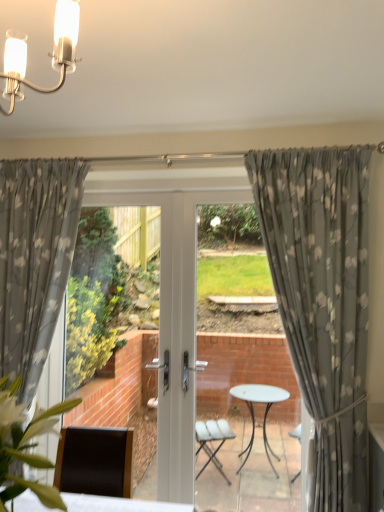
This screenshot has width=384, height=512. In order to click on white glossy light fixture at upper left in this screenshot , I will do `click(48, 54)`.

How much space does gray floral fabric curtain at center, which is counted as the 2th curtain, starting from the left, occupy vertically?

The height of gray floral fabric curtain at center, which is counted as the 2th curtain, starting from the left, is 6.14 feet.

The width and height of the screenshot is (384, 512). Describe the element at coordinates (35, 259) in the screenshot. I see `gray floral curtain at left, which is the first curtain in left-to-right order` at that location.

Locate an element on the screen. The width and height of the screenshot is (384, 512). green leafy plant at lower left is located at coordinates (25, 445).

Are gray floral curtain at left, which is the first curtain in left-to-right order, and green leafy plant at lower left beside each other?

gray floral curtain at left, which is the first curtain in left-to-right order, and green leafy plant at lower left are not in contact.

From a real-world perspective, is gray floral curtain at left, which is the first curtain in left-to-right order, over green leafy plant at lower left?

Correct, in the physical world, gray floral curtain at left, which is the first curtain in left-to-right order, is higher than green leafy plant at lower left.

Is green leafy plant at lower left located within gray floral curtain at left, which is the first curtain in left-to-right order?

Actually, green leafy plant at lower left is outside gray floral curtain at left, which is the first curtain in left-to-right order.

Measure the distance from white glossy light fixture at upper left to gray floral curtain at left, which ranks as the 2th curtain in right-to-left order.

4.44 feet.

Is white glossy light fixture at upper left beside gray floral curtain at left, which ranks as the 2th curtain in right-to-left order?

No, white glossy light fixture at upper left is not next to gray floral curtain at left, which ranks as the 2th curtain in right-to-left order.

Can you confirm if white glossy light fixture at upper left is bigger than gray floral curtain at left, which ranks as the 2th curtain in right-to-left order?

No, white glossy light fixture at upper left is not bigger than gray floral curtain at left, which ranks as the 2th curtain in right-to-left order.

Is white glossy light fixture at upper left positioned before gray floral curtain at left, which is the first curtain in left-to-right order?

Yes, the depth of white glossy light fixture at upper left is less than that of gray floral curtain at left, which is the first curtain in left-to-right order.

Who is shorter, white glossy light fixture at upper left or green leafy plant at lower left?

white glossy light fixture at upper left is shorter.

From the image's perspective, which one is positioned lower, white glossy light fixture at upper left or green leafy plant at lower left?

From the image's view, green leafy plant at lower left is below.

Between white glossy light fixture at upper left and green leafy plant at lower left, which one appears on the left side from the viewer's perspective?

From the viewer's perspective, green leafy plant at lower left appears more on the left side.

Does gray floral fabric curtain at center, the first curtain viewed from the right, have a greater width compared to white glossy light fixture at upper left?

No.

Would you say gray floral fabric curtain at center, the first curtain viewed from the right, is outside white glossy light fixture at upper left?

Yes, gray floral fabric curtain at center, the first curtain viewed from the right, is not within white glossy light fixture at upper left.

From a real-world perspective, is gray floral fabric curtain at center, the first curtain viewed from the right, located beneath white glossy light fixture at upper left?

Yes, from a real-world perspective, gray floral fabric curtain at center, the first curtain viewed from the right, is beneath white glossy light fixture at upper left.

Is gray floral fabric curtain at center, the first curtain viewed from the right, positioned with its back to white glossy light fixture at upper left?

That's not correct — gray floral fabric curtain at center, the first curtain viewed from the right, is not looking away from white glossy light fixture at upper left.

Is gray floral curtain at left, which ranks as the 2th curtain in right-to-left order, turned away from gray floral fabric curtain at center, which is counted as the 2th curtain, starting from the left?

gray floral curtain at left, which ranks as the 2th curtain in right-to-left order, does not have its back to gray floral fabric curtain at center, which is counted as the 2th curtain, starting from the left.

Looking at their sizes, would you say gray floral curtain at left, which ranks as the 2th curtain in right-to-left order, is wider or thinner than gray floral fabric curtain at center, which is counted as the 2th curtain, starting from the left?

gray floral curtain at left, which ranks as the 2th curtain in right-to-left order, is thinner than gray floral fabric curtain at center, which is counted as the 2th curtain, starting from the left.

Which object is more forward, gray floral curtain at left, which is the first curtain in left-to-right order, or gray floral fabric curtain at center, the first curtain viewed from the right?

Positioned in front is gray floral fabric curtain at center, the first curtain viewed from the right.

Is gray floral curtain at left, which is the first curtain in left-to-right order, at the left side of gray floral fabric curtain at center, which is counted as the 2th curtain, starting from the left?

Correct, you'll find gray floral curtain at left, which is the first curtain in left-to-right order, to the left of gray floral fabric curtain at center, which is counted as the 2th curtain, starting from the left.

Based on their sizes in the image, would you say green leafy plant at lower left is bigger or smaller than white glossy light fixture at upper left?

green leafy plant at lower left is bigger than white glossy light fixture at upper left.

Would you say green leafy plant at lower left is to the left or to the right of white glossy light fixture at upper left in the picture?

green leafy plant at lower left is positioned on white glossy light fixture at upper left's left side.

Find the location of `plant below the white glossy light fixture at upper left (from a real-world perspective)`. plant below the white glossy light fixture at upper left (from a real-world perspective) is located at coordinates (25, 445).

Is green leafy plant at lower left facing away from white glossy light fixture at upper left?

No, white glossy light fixture at upper left is not at the back of green leafy plant at lower left.

Between gray floral fabric curtain at center, which is counted as the 2th curtain, starting from the left, and green leafy plant at lower left, which one has smaller size?

With smaller size is green leafy plant at lower left.

You are a GUI agent. You are given a task and a screenshot of the screen. Output one action in this format:
    pyautogui.click(x=<x>, y=<y>)
    Task: Click on the plant lying on the left of gray floral fabric curtain at center, the first curtain viewed from the right
    Image resolution: width=384 pixels, height=512 pixels.
    Given the screenshot: What is the action you would take?
    pyautogui.click(x=25, y=445)

Does gray floral fabric curtain at center, the first curtain viewed from the right, appear on the left side of green leafy plant at lower left?

No, gray floral fabric curtain at center, the first curtain viewed from the right, is not to the left of green leafy plant at lower left.

Identify the location of curtain that is the 2nd object located behind the green leafy plant at lower left. (35, 259).

Identify the location of curtain on the left of white glossy light fixture at upper left. (35, 259).

Estimate the real-world distances between objects in this image. Which object is closer to white glossy light fixture at upper left, green leafy plant at lower left or gray floral curtain at left, which is the first curtain in left-to-right order?

Among the two, green leafy plant at lower left is located nearer to white glossy light fixture at upper left.

Based on their spatial positions, is green leafy plant at lower left or gray floral fabric curtain at center, which is counted as the 2th curtain, starting from the left, closer to white glossy light fixture at upper left?

green leafy plant at lower left is positioned closer to the anchor white glossy light fixture at upper left.

When comparing their distances from green leafy plant at lower left, does gray floral fabric curtain at center, which is counted as the 2th curtain, starting from the left, or gray floral curtain at left, which ranks as the 2th curtain in right-to-left order, seem closer?

gray floral curtain at left, which ranks as the 2th curtain in right-to-left order, lies closer to green leafy plant at lower left than the other object.

Looking at the image, which one is located closer to gray floral fabric curtain at center, which is counted as the 2th curtain, starting from the left, green leafy plant at lower left or white glossy light fixture at upper left?

green leafy plant at lower left is closer to gray floral fabric curtain at center, which is counted as the 2th curtain, starting from the left.

Looking at the image, which one is located further to green leafy plant at lower left, gray floral curtain at left, which is the first curtain in left-to-right order, or gray floral fabric curtain at center, the first curtain viewed from the right?

Among the two, gray floral fabric curtain at center, the first curtain viewed from the right, is located further to green leafy plant at lower left.

Looking at the image, which one is located closer to green leafy plant at lower left, gray floral curtain at left, which ranks as the 2th curtain in right-to-left order, or white glossy light fixture at upper left?

Based on the image, white glossy light fixture at upper left appears to be nearer to green leafy plant at lower left.

When comparing their distances from gray floral curtain at left, which ranks as the 2th curtain in right-to-left order, does white glossy light fixture at upper left or green leafy plant at lower left seem closer?

green leafy plant at lower left is closer to gray floral curtain at left, which ranks as the 2th curtain in right-to-left order.

From the image, which object appears to be farther from gray floral curtain at left, which ranks as the 2th curtain in right-to-left order, green leafy plant at lower left or white glossy light fixture at upper left?

white glossy light fixture at upper left is further to gray floral curtain at left, which ranks as the 2th curtain in right-to-left order.

I want to click on light fixture between green leafy plant at lower left and gray floral curtain at left, which is the first curtain in left-to-right order, from front to back, so click(48, 54).

Find the location of a particular element. This screenshot has height=512, width=384. curtain between white glossy light fixture at upper left and gray floral curtain at left, which is the first curtain in left-to-right order, in the front-back direction is located at coordinates (322, 301).

Locate an element on the screen. light fixture between green leafy plant at lower left and gray floral fabric curtain at center, which is counted as the 2th curtain, starting from the left, in the front-back direction is located at coordinates (48, 54).

Find the location of a particular element. This screenshot has width=384, height=512. curtain located between green leafy plant at lower left and gray floral curtain at left, which ranks as the 2th curtain in right-to-left order, in the depth direction is located at coordinates (322, 301).